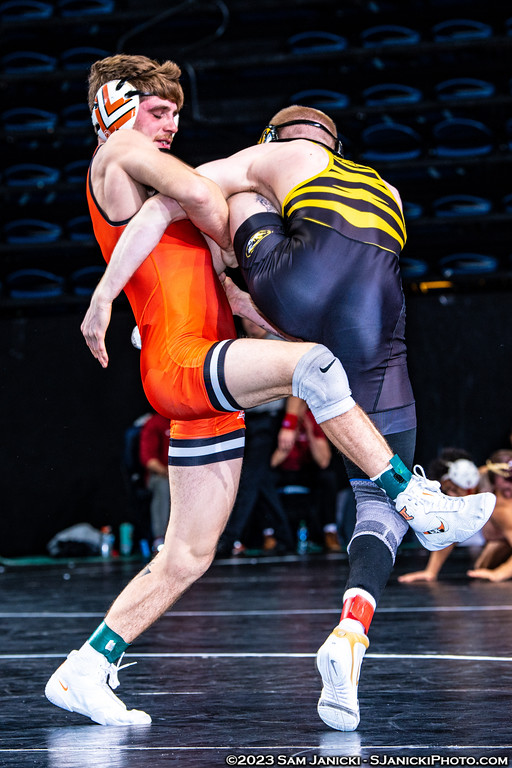
The height and width of the screenshot is (768, 512). Find the location of `mat`. mat is located at coordinates (252, 654).